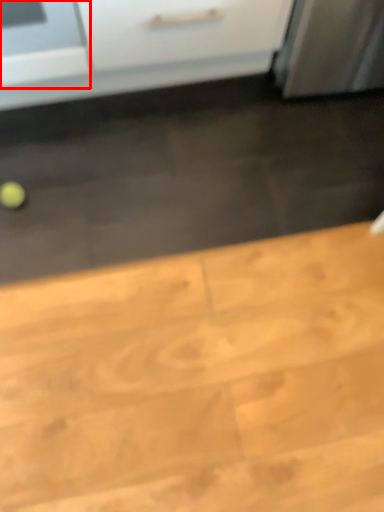
Question: Observing the image, what is the correct spatial positioning of appliance (annotated by the red box) in reference to table?

Choices:
 (A) left
 (B) right

Answer: (A)